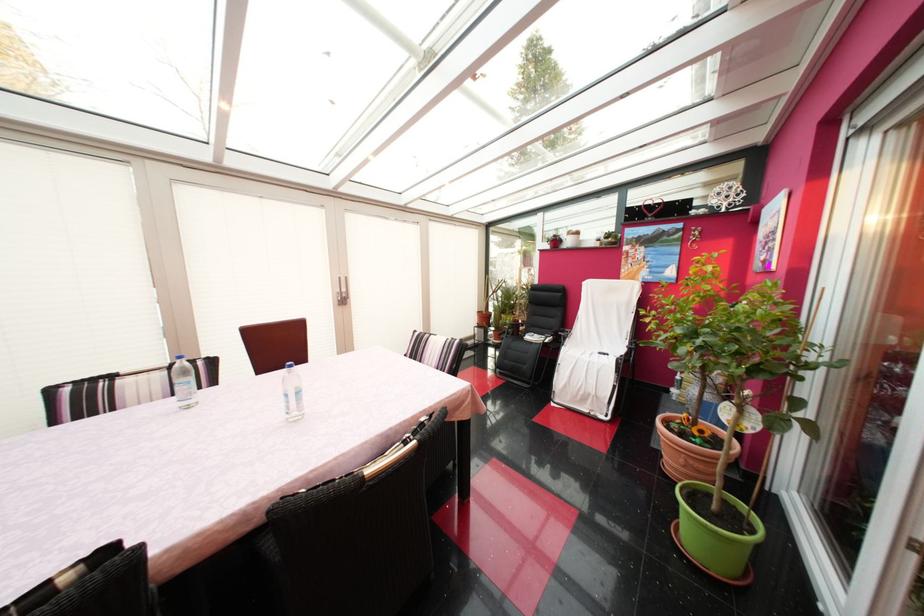
This screenshot has width=924, height=616. In order to click on green plant pot in this screenshot , I will do (715, 532).